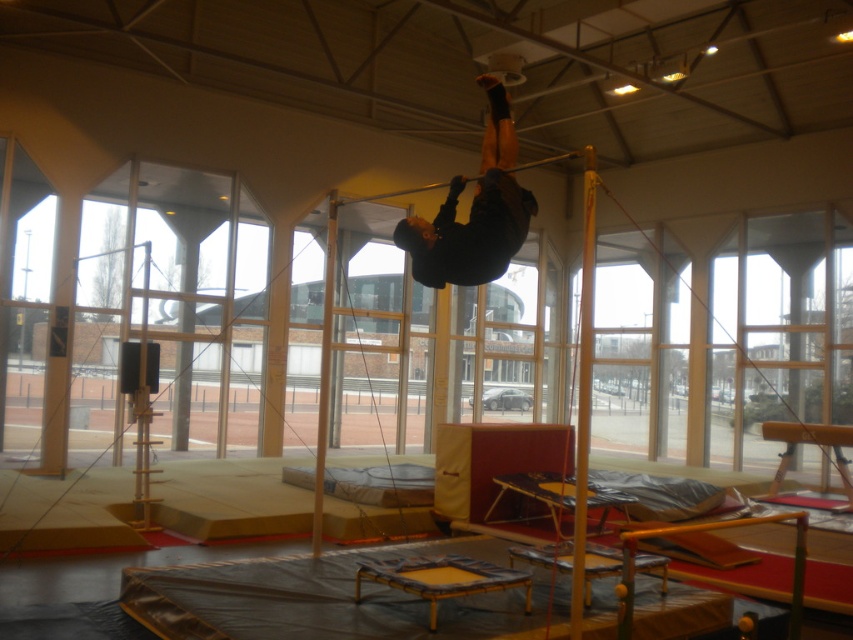
Which is below, black matte clothing at upper center or black rubber bar at center?

black matte clothing at upper center

Does point (410, 259) come in front of point (408, 192)?

Yes, it is in front of point (408, 192).

The width and height of the screenshot is (853, 640). What do you see at coordinates (474, 212) in the screenshot?
I see `black matte clothing at upper center` at bounding box center [474, 212].

Image resolution: width=853 pixels, height=640 pixels. What are the coordinates of `black matte clothing at upper center` in the screenshot? It's located at (474, 212).